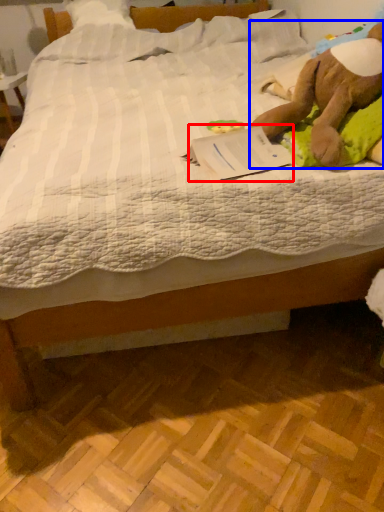
Question: Which object appears farthest to the camera in this image, paperback book (highlighted by a red box) or animal (highlighted by a blue box)?

Choices:
 (A) paperback book
 (B) animal

Answer: (A)